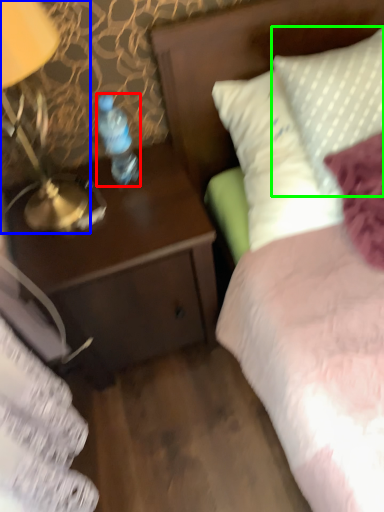
Question: Based on their relative distances, which object is farther from bottle (highlighted by a red box)? Choose from lamp (highlighted by a blue box) and pillow (highlighted by a green box).

Choices:
 (A) lamp
 (B) pillow

Answer: (B)